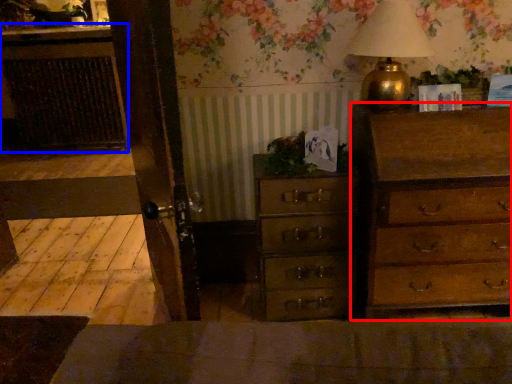
Question: Which object is further to the camera taking this photo, chest of drawers (highlighted by a red box) or cabinetry (highlighted by a blue box)?

Choices:
 (A) chest of drawers
 (B) cabinetry

Answer: (B)